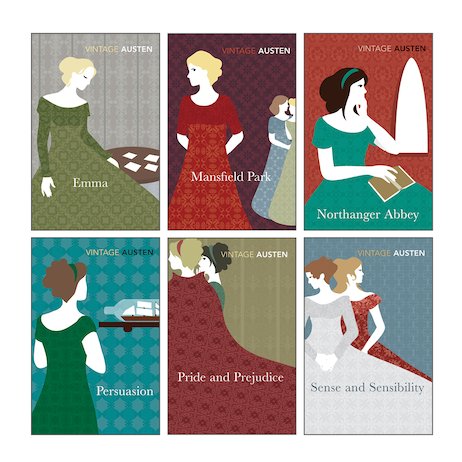
Identify the location of window. (414, 99).